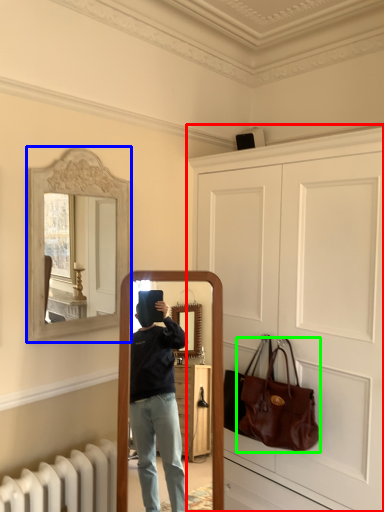
Question: Considering the real-world distances, which object is farthest from door (highlighted by a red box)? picture frame (highlighted by a blue box) or handbag (highlighted by a green box)?

Choices:
 (A) picture frame
 (B) handbag

Answer: (A)